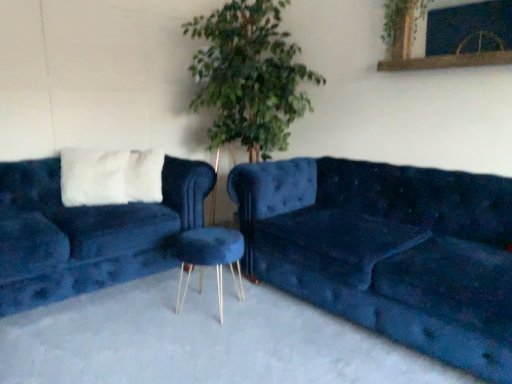
Image resolution: width=512 pixels, height=384 pixels. Identify the location of spots to the right of velvet blue stool at center. (266, 306).